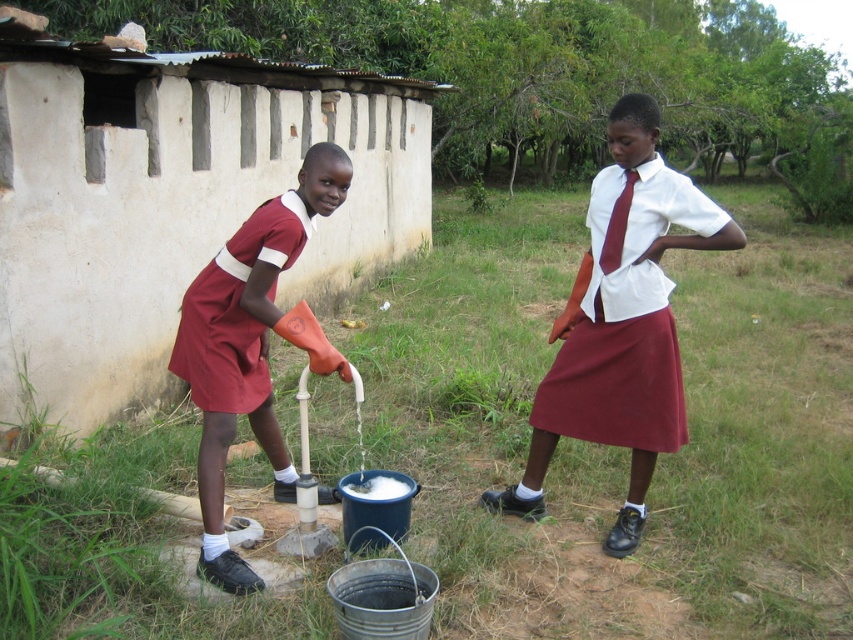
Can you confirm if maroon fabric dress at right is taller than maroon fabric dress at left?

Indeed, maroon fabric dress at right has a greater height compared to maroon fabric dress at left.

Which is behind, point (630, 237) or point (198, 280)?

The point (630, 237) is more distant.

Between point (654, 392) and point (224, 259), which one is positioned in front?

Positioned in front is point (224, 259).

You are a GUI agent. You are given a task and a screenshot of the screen. Output one action in this format:
    pyautogui.click(x=<x>, y=<y>)
    Task: Click on the maroon fabric dress at right
    The height and width of the screenshot is (640, 853).
    Given the screenshot: What is the action you would take?
    pyautogui.click(x=625, y=316)

Does matte white shirt at center appear under maroon fabric dress at right?

Yes.

Is matte white shirt at center behind maroon fabric dress at right?

Yes, it is.

Is point (604, 428) positioned before point (650, 269)?

No, (604, 428) is further to viewer.

Where is `matte white shirt at center`? This screenshot has height=640, width=853. matte white shirt at center is located at coordinates (621, 323).

Is matte white shirt at center above maroon fabric dress at left?

Incorrect, matte white shirt at center is not positioned above maroon fabric dress at left.

Between matte white shirt at center and maroon fabric dress at left, which one has more height?

With more height is matte white shirt at center.

Does point (648, 362) come closer to viewer compared to point (227, 250)?

No.

Locate an element on the screen. The width and height of the screenshot is (853, 640). matte white shirt at center is located at coordinates (621, 323).